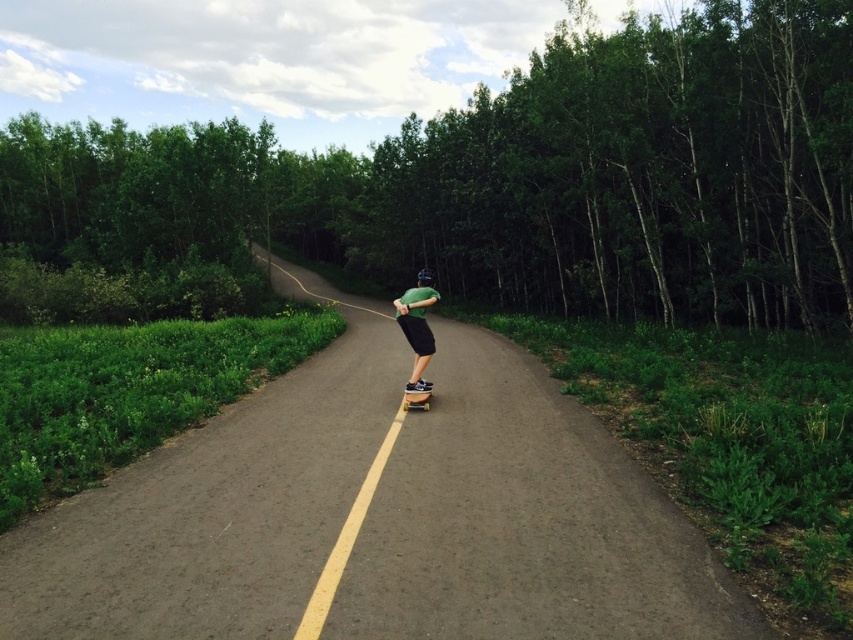
You are the skateboarder in the scene and want to know if the point at coordinate (560, 275) is located behind the point at coordinate (404, 323) along the road. Based on the scene description, can you determine the relative position of these two points?

Yes, according to the objects description, point (560, 275) is behind point (404, 323) along the road.

You are a photographer trying to capture the skateboarder in the scene. Since the green matte shirt at center and the wooden skateboard at center are both in focus, which one would appear wider in the photo?

The green matte shirt at center would appear wider in the photo because its width is larger than that of the wooden skateboard at center according to the description.

Based on the photo, you are a photographer trying to capture the skateboarder and the tree in the same frame. Since the wooden skateboard at center is behind the green leafy tree at center, how should you adjust your position to ensure both are visible?

To capture both the wooden skateboard at center and the green leafy tree at center in the same frame, you should move to the side so that the wooden skateboard at center is no longer directly behind the green leafy tree at center, allowing both to be visible.